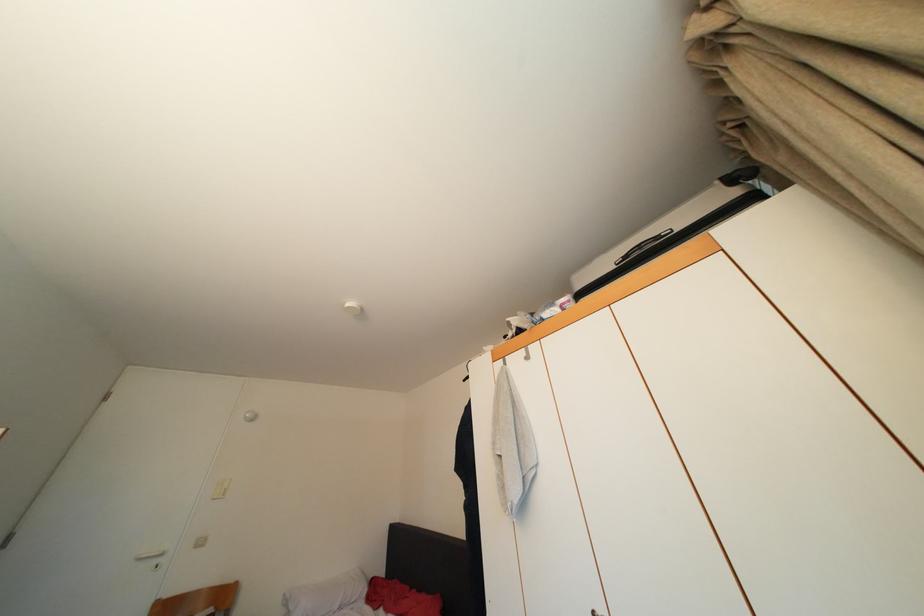
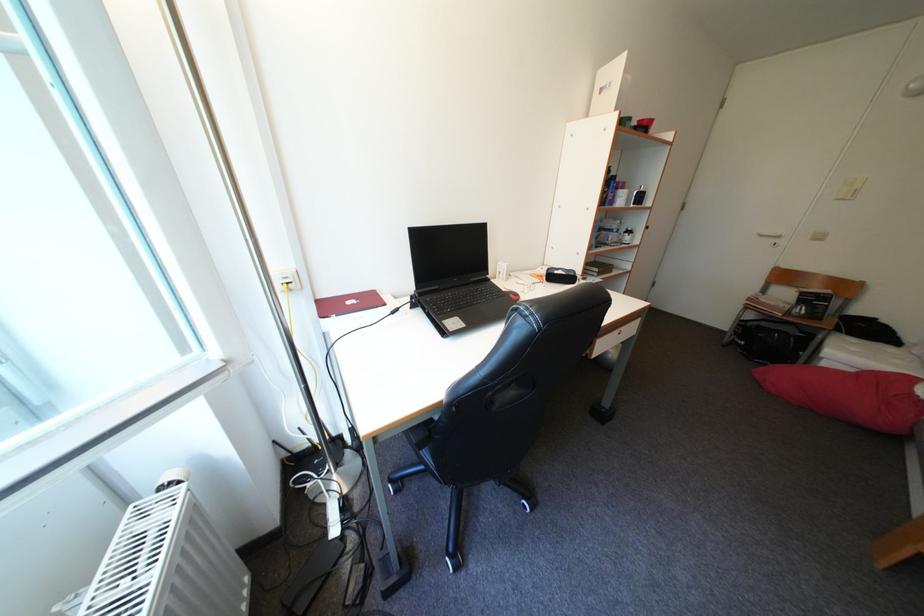
How did the camera likely rotate?

The camera rotated toward left-down.